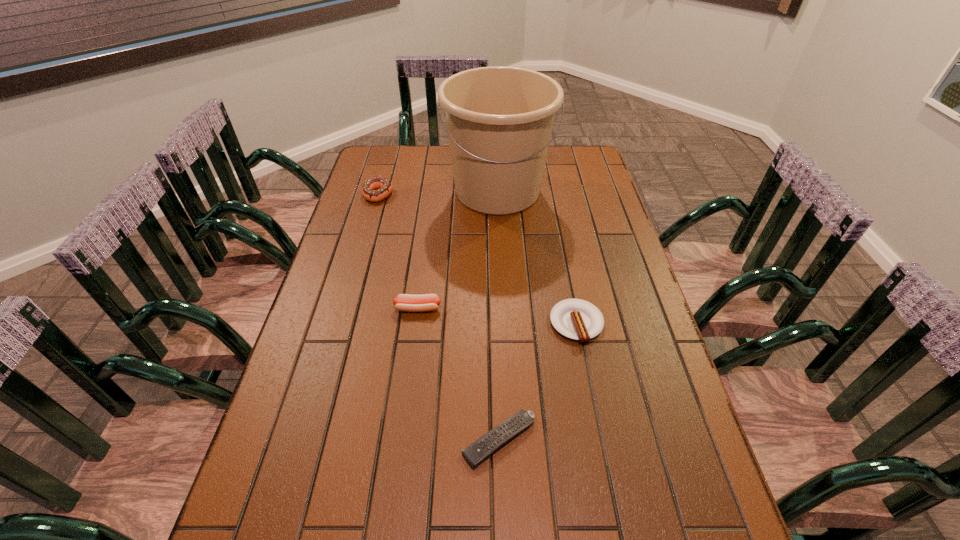
Identify the location of free spot located 0.340m on the left of the right sausage. This screenshot has width=960, height=540. (422, 323).

This screenshot has height=540, width=960. Find the location of `vacant area situated on the left of the nearest object`. vacant area situated on the left of the nearest object is located at coordinates (291, 440).

Find the location of a particular element. Image resolution: width=960 pixels, height=540 pixels. object situated at the far edge is located at coordinates (499, 119).

This screenshot has height=540, width=960. Find the location of `object situated at the left edge`. object situated at the left edge is located at coordinates (384, 187).

Find the location of `object that is at the right edge`. object that is at the right edge is located at coordinates (577, 319).

In the image, there is a desktop. Identify the location of vacant space at the left edge. (298, 511).

Where is `free space at the right edge`? free space at the right edge is located at coordinates (608, 224).

The height and width of the screenshot is (540, 960). What are the coordinates of `free space at the far right corner` in the screenshot? It's located at (559, 176).

Where is `unoccupied position between the right sausage and the shortest object`? unoccupied position between the right sausage and the shortest object is located at coordinates (538, 382).

The width and height of the screenshot is (960, 540). What are the coordinates of `blank region between the right sausage and the nearest object` in the screenshot? It's located at (538, 382).